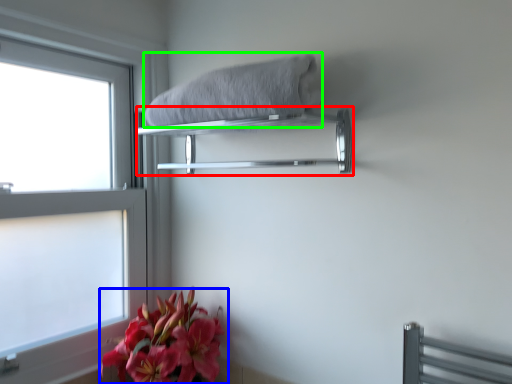
Question: Based on their relative distances, which object is farther from balustrade (highlighted by a red box)? Choose from flower (highlighted by a blue box) and bath towel (highlighted by a green box).

Choices:
 (A) flower
 (B) bath towel

Answer: (A)